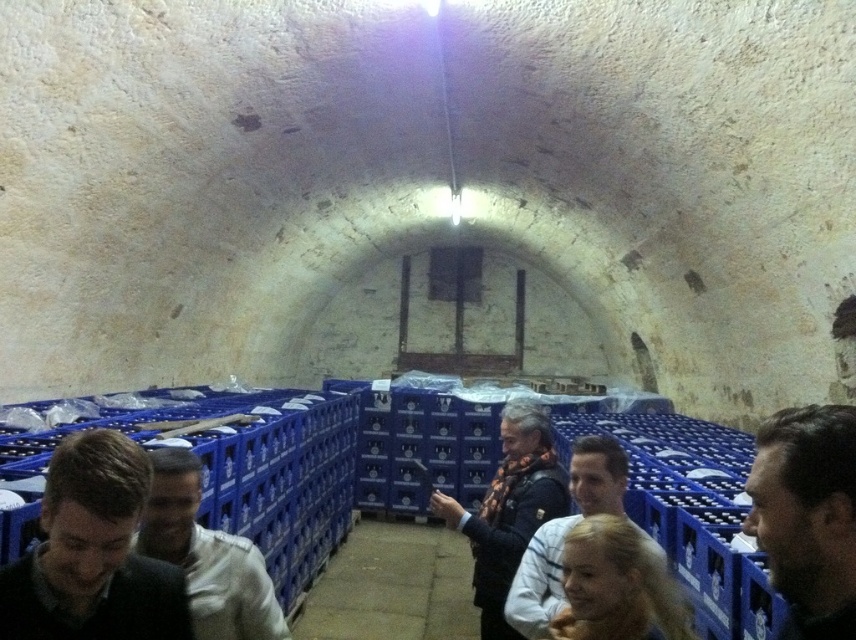
Question: Which of the following is the farthest from the observer?

Choices:
 (A) (437, 499)
 (B) (223, 632)
 (C) (173, 609)

Answer: (A)

Question: Is white matte shirt at lower left above orange scarf at center?

Choices:
 (A) no
 (B) yes

Answer: (B)

Question: Does dark brown hair at lower left have a greater width compared to white matte shirt at lower left?

Choices:
 (A) no
 (B) yes

Answer: (A)

Question: Which object is positioned farthest from the dark brown hair at right?

Choices:
 (A) dark blue jacket at lower center
 (B) white matte shirt at lower left
 (C) orange scarf at center
 (D) dark brown hair at lower left

Answer: (C)

Question: Which of the following is the closest to the observer?

Choices:
 (A) orange scarf at center
 (B) dark blue jacket at lower center
 (C) white matte shirt at lower left

Answer: (C)

Question: Can you confirm if white matte shirt at lower left is positioned below dark blue jacket at lower center?

Choices:
 (A) yes
 (B) no

Answer: (B)